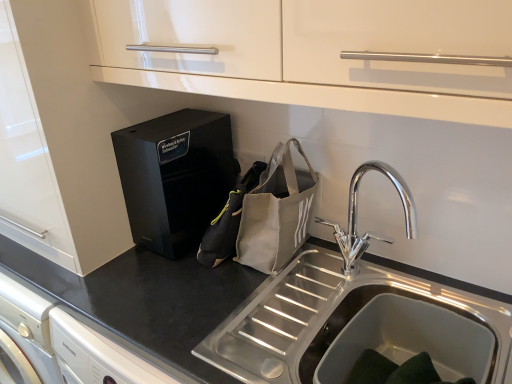
Question: Is point (266, 175) positioned closer to the camera than point (224, 130)?

Choices:
 (A) farther
 (B) closer

Answer: (B)

Question: Is canvas tote bag at sink, arranged as the 2th pouch when viewed from the left, to the left or to the right of black glossy speaker at center in the image?

Choices:
 (A) right
 (B) left

Answer: (A)

Question: Estimate the real-world distances between objects in this image. Which object is farther from the canvas tote bag at sink, arranged as the 2th pouch when viewed from the left?

Choices:
 (A) black matte countertop at center
 (B) gray fabric pouch at center, the second pouch viewed from the right
 (C) black glossy speaker at center
 (D) chrome metallic faucet at upper right

Answer: (C)

Question: Considering the real-world distances, which object is farthest from the gray fabric pouch at center, the second pouch viewed from the right?

Choices:
 (A) canvas tote bag at sink, arranged as the 2th pouch when viewed from the left
 (B) black matte countertop at center
 (C) chrome metallic faucet at upper right
 (D) black glossy speaker at center

Answer: (C)